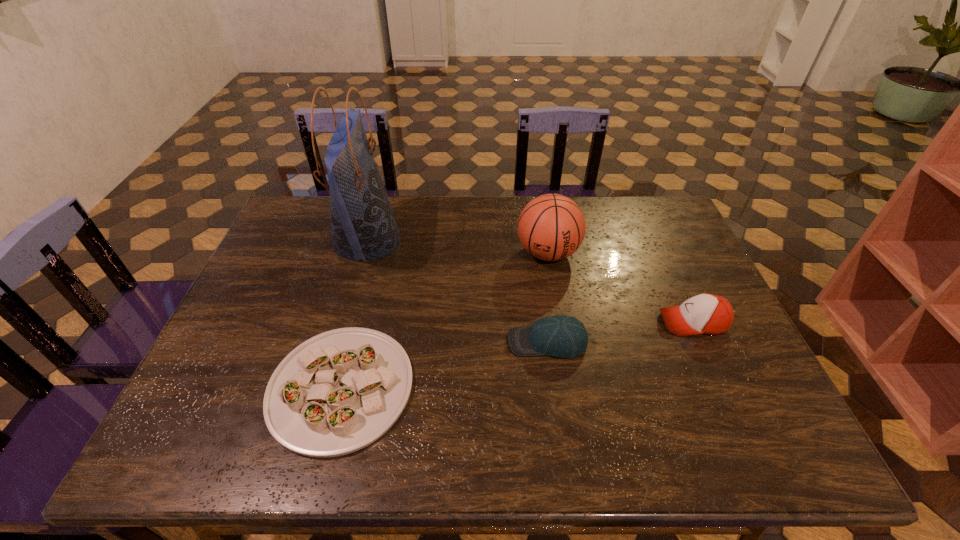
You are a GUI agent. You are given a task and a screenshot of the screen. Output one action in this format:
    pyautogui.click(x=<x>, y=<y>)
    Task: Click on the tallest object
    This screenshot has width=960, height=540.
    Given the screenshot: What is the action you would take?
    pyautogui.click(x=363, y=226)

Find the location of `basketball`. basketball is located at coordinates (551, 227).

Identify the location of the right baseball cap. (709, 314).

This screenshot has height=540, width=960. In order to click on the third tallest object in this screenshot , I will do `click(709, 314)`.

Image resolution: width=960 pixels, height=540 pixels. Identify the location of the fourth tallest object. click(x=562, y=336).

Where is `the left baseball cap`? This screenshot has height=540, width=960. the left baseball cap is located at coordinates (562, 336).

What are the coordinates of `platter` in the screenshot? It's located at (339, 391).

Locate an element on the screen. This screenshot has height=540, width=960. vacant area situated 0.060m on the right of the tallest object is located at coordinates (420, 240).

Find the location of a particular element. The height and width of the screenshot is (540, 960). vacant space located 0.080m on the surface of the fourth shortest object near the brand logo is located at coordinates (555, 294).

What are the coordinates of `vacant space situated on the front-facing side of the right baseball cap` in the screenshot? It's located at (516, 322).